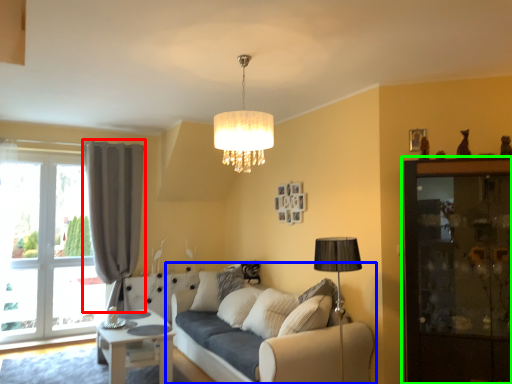
Question: Which object is the farthest from curtain (highlighted by a red box)? Choose among these: studio couch (highlighted by a blue box) or dresser (highlighted by a green box).

Choices:
 (A) studio couch
 (B) dresser

Answer: (B)